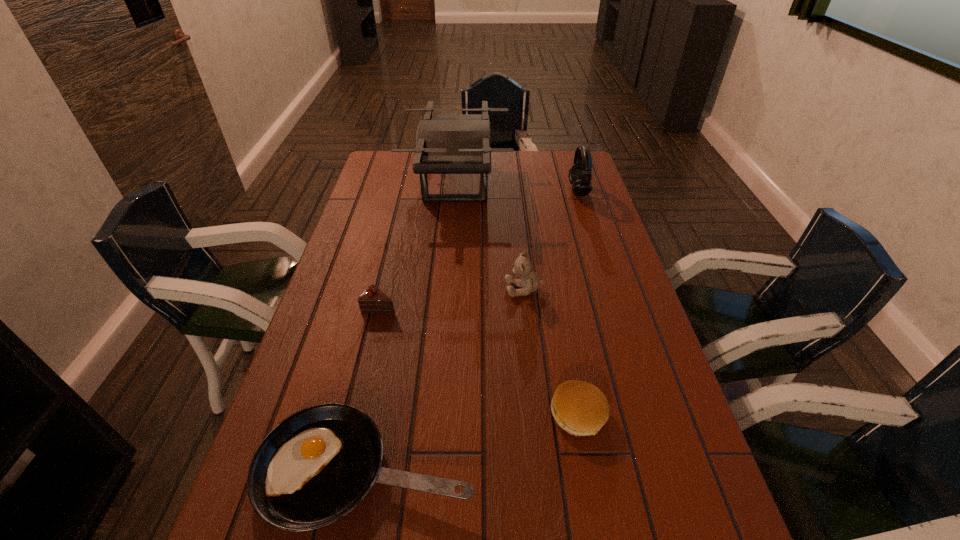
Locate an element on the screen. The image size is (960, 540). chocolate cake present at the left edge is located at coordinates (372, 300).

Find the location of a particular element. This screenshot has width=960, height=540. frying pan located in the left edge section of the desktop is located at coordinates (314, 467).

The image size is (960, 540). I want to click on headset at the right edge, so click(x=580, y=173).

Where is `patty that is at the right edge`? The image size is (960, 540). patty that is at the right edge is located at coordinates (581, 409).

Image resolution: width=960 pixels, height=540 pixels. In order to click on object at the far left corner in this screenshot , I will do `click(445, 143)`.

You are a GUI agent. You are given a task and a screenshot of the screen. Output one action in this format:
    pyautogui.click(x=<x>, y=<y>)
    Task: Click on the object at the far right corner
    The height and width of the screenshot is (540, 960).
    Given the screenshot: What is the action you would take?
    pyautogui.click(x=580, y=173)

In the image, there is a desktop. Where is `vacant area at the far edge`? vacant area at the far edge is located at coordinates (504, 167).

In the image, there is a desktop. Find the location of `vacant space at the left edge`. vacant space at the left edge is located at coordinates (348, 323).

Find the location of `vacant space at the right edge of the desktop`. vacant space at the right edge of the desktop is located at coordinates (704, 520).

Locate an element on the screen. The height and width of the screenshot is (540, 960). free space at the far right corner is located at coordinates (556, 158).